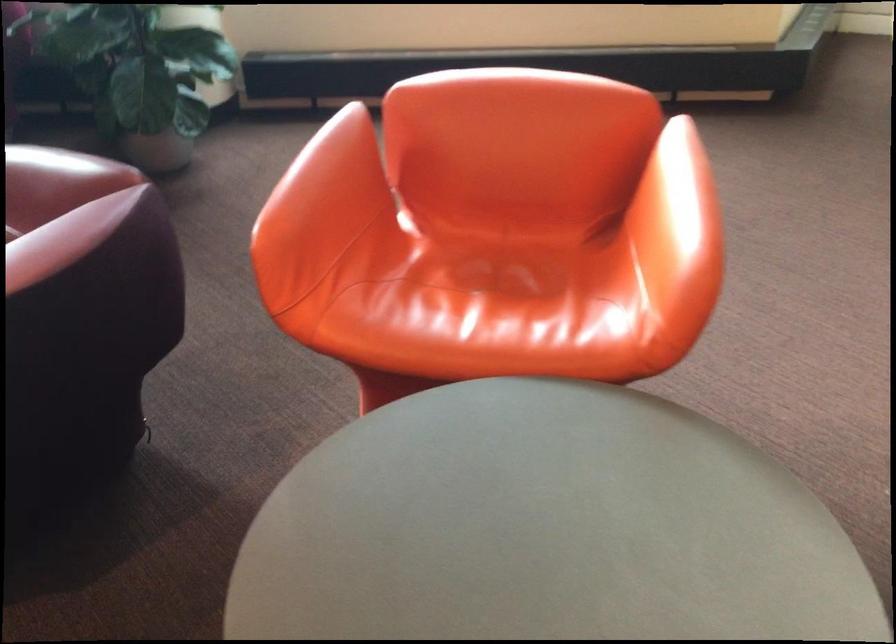
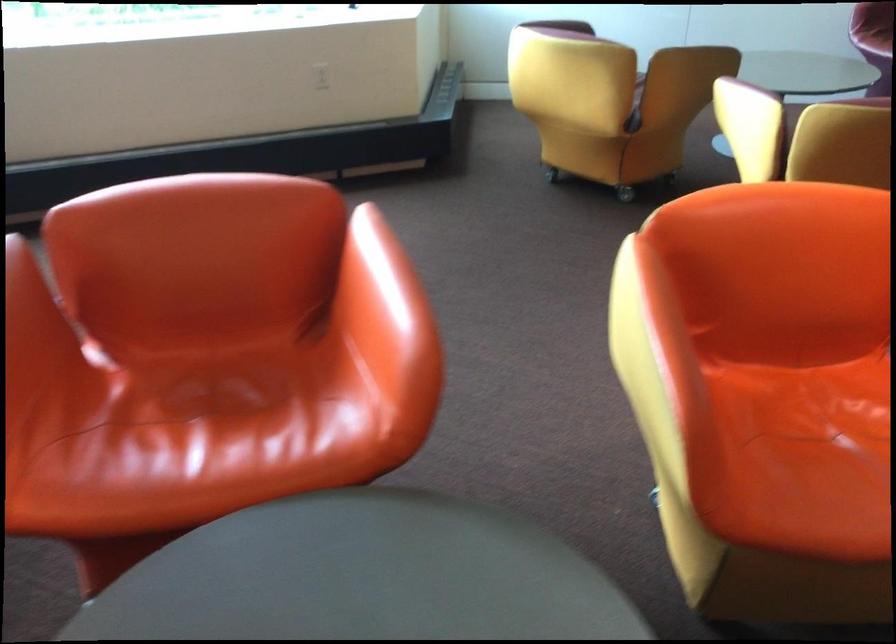
In a continuous first-person perspective shot, in which direction is the camera moving?

The movement direction of the cameraman is right, forward.